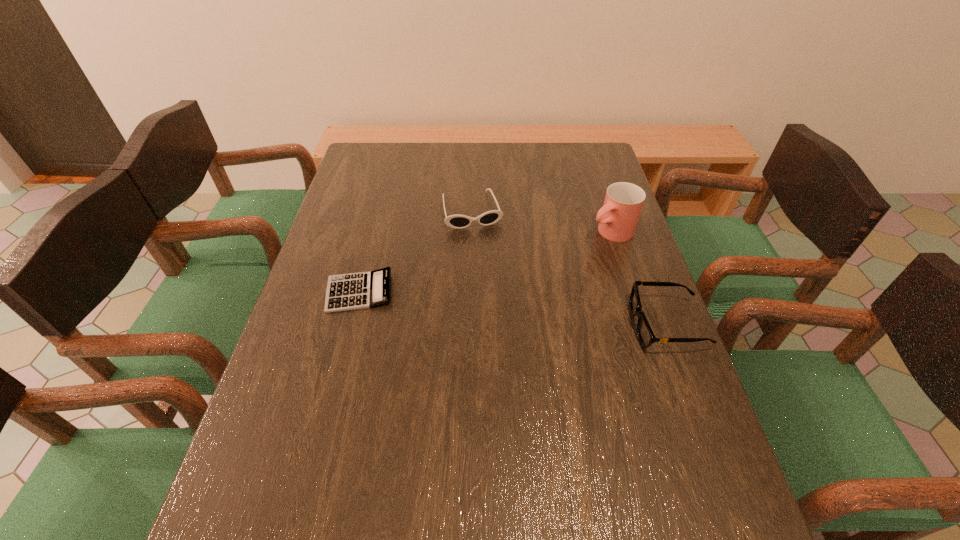
Where is `the shortest object`? Image resolution: width=960 pixels, height=540 pixels. the shortest object is located at coordinates (x=363, y=290).

Image resolution: width=960 pixels, height=540 pixels. In order to click on the leftmost object in this screenshot , I will do `click(363, 290)`.

This screenshot has height=540, width=960. I want to click on the right sunglasses, so click(x=645, y=334).

Where is `cup`? cup is located at coordinates (618, 217).

You are a GUI agent. You are given a task and a screenshot of the screen. Output one action in this format:
    pyautogui.click(x=<x>, y=<y>)
    Task: Click on the farther sunglasses
    Image resolution: width=960 pixels, height=540 pixels.
    Given the screenshot: What is the action you would take?
    (488, 218)

I want to click on the second object from left to right, so click(x=488, y=218).

You are a GUI agent. You are given a task and a screenshot of the screen. Output one action in this format:
    pyautogui.click(x=<x>, y=<y>)
    Task: Click on the vacant space located 0.120m on the back of the leftmost object
    
    Given the screenshot: What is the action you would take?
    pyautogui.click(x=372, y=242)

Locate an element on the screen. This screenshot has width=960, height=540. free region located 0.080m on the front-facing side of the nearer sunglasses is located at coordinates (598, 325).

You are a GUI agent. You are given a task and a screenshot of the screen. Output one action in this format:
    pyautogui.click(x=<x>, y=<y>)
    Task: Click on the vacant point located on the front-facing side of the nearer sunglasses
    
    Given the screenshot: What is the action you would take?
    pyautogui.click(x=544, y=325)

Find the location of `vacant space located 0.240m on the front-facing side of the nearer sunglasses`. vacant space located 0.240m on the front-facing side of the nearer sunglasses is located at coordinates click(532, 325).